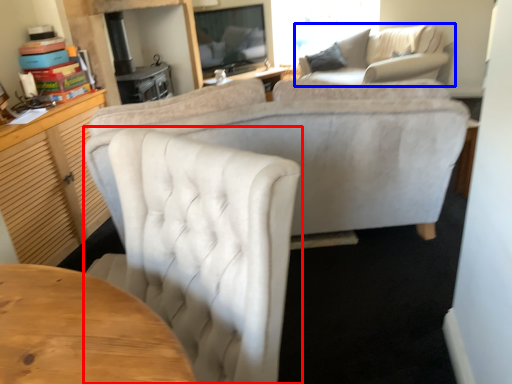
Question: Which of the following is the farthest to the observer, chair (highlighted by a red box) or studio couch (highlighted by a blue box)?

Choices:
 (A) chair
 (B) studio couch

Answer: (B)